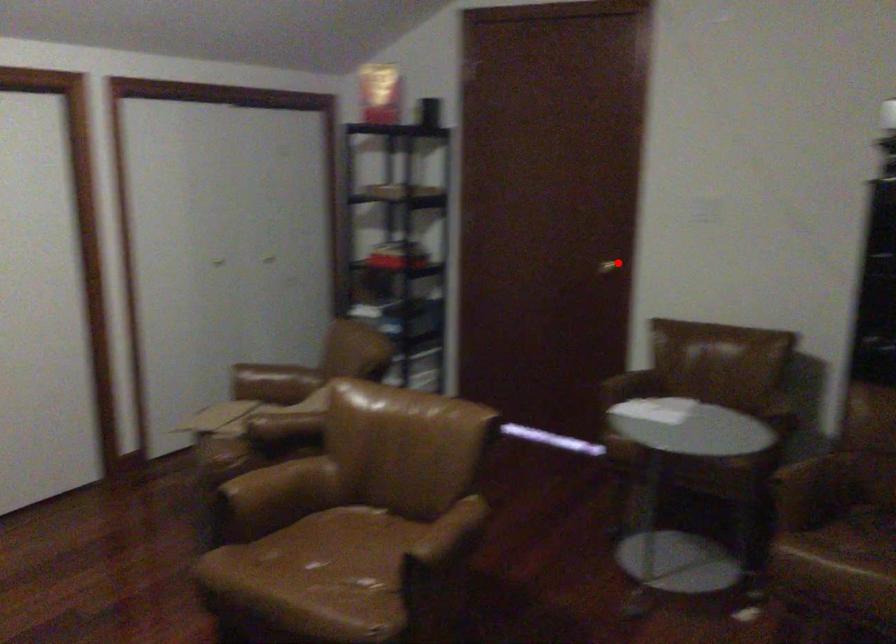
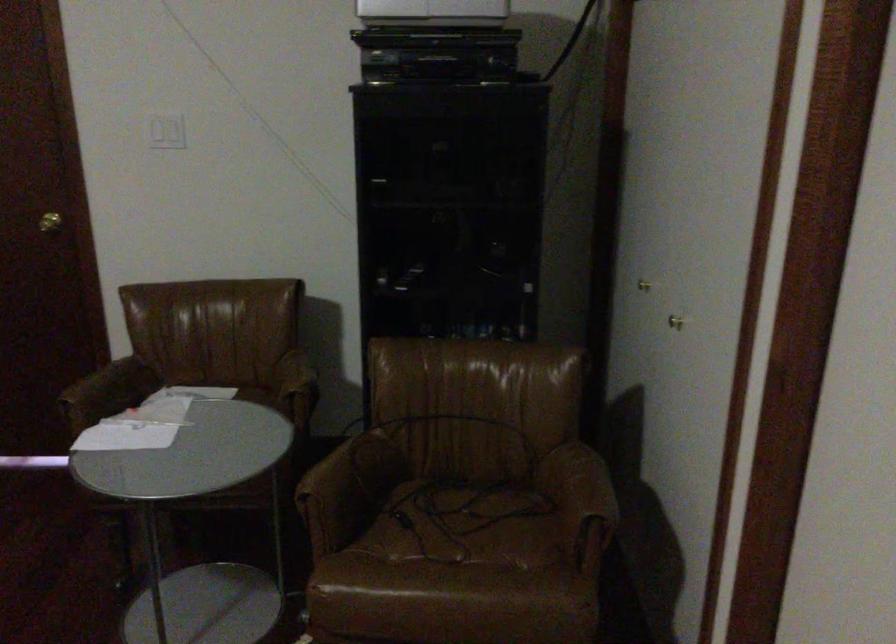
Locate, in the second image, the point that corresponds to the highlighted location in the first image.

(49, 222)